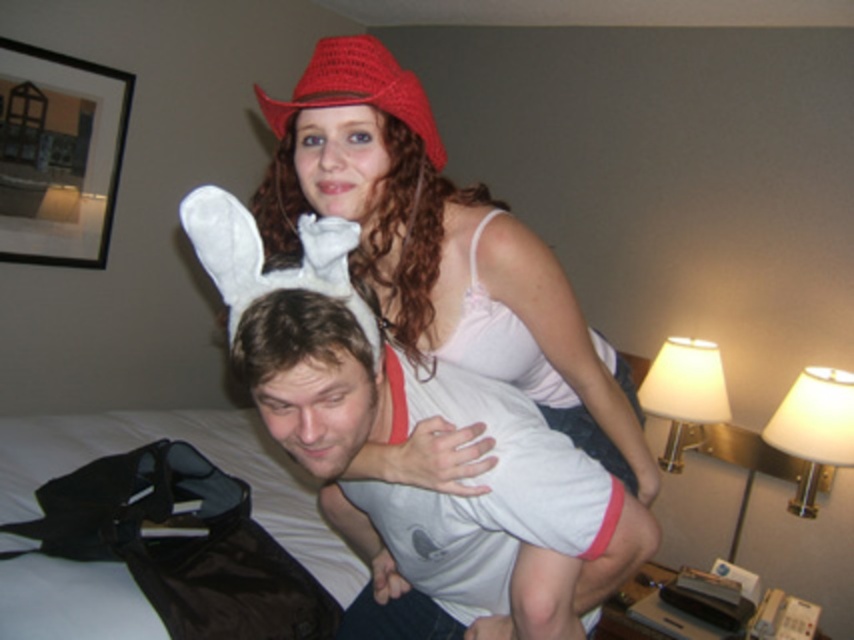
How much distance is there between white plush hat at upper center and crochet red hat at upper center?

white plush hat at upper center and crochet red hat at upper center are 7.12 inches apart from each other.

Where is `white plush hat at upper center`? This screenshot has height=640, width=854. white plush hat at upper center is located at coordinates (262, 259).

Who is shorter, white cotton shirt at upper center or white plush hat at upper center?

white plush hat at upper center is shorter.

Is point (592, 538) closer to camera compared to point (314, 289)?

No.

Between point (387, 531) and point (338, 243), which one is positioned behind?

Positioned behind is point (387, 531).

This screenshot has height=640, width=854. I want to click on white cotton shirt at upper center, so click(395, 433).

Between white cotton shirt at upper center and crochet red hat at upper center, which one has less height?

crochet red hat at upper center

Between point (272, 342) and point (332, 76), which one is positioned in front?

Point (272, 342) is more forward.

This screenshot has width=854, height=640. What are the coordinates of `white cotton shirt at upper center` in the screenshot? It's located at (395, 433).